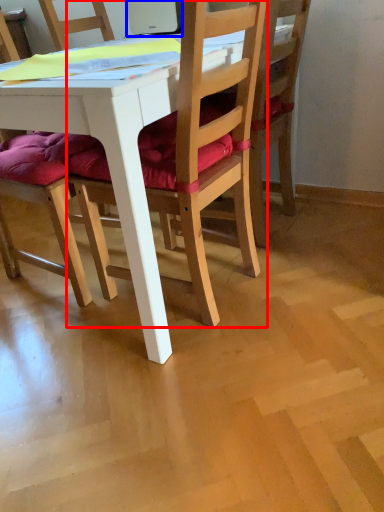
Question: Which object appears farthest to the camera in this image, chair (highlighted by a red box) or laptop (highlighted by a blue box)?

Choices:
 (A) chair
 (B) laptop

Answer: (B)